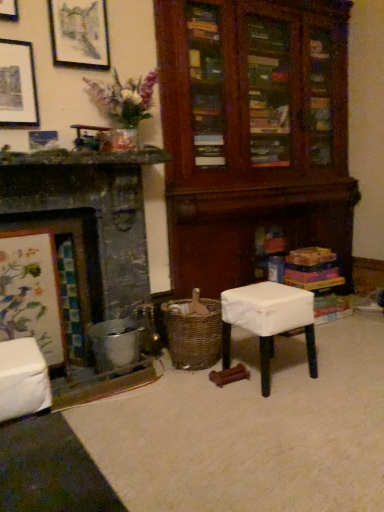
How much space does matte black picture frame at upper left, which appears as the 3th picture frame when ordered from the bottom, occupy vertically?

17.07 inches.

Where is `metallic silver fireplace at left`? Image resolution: width=384 pixels, height=512 pixels. metallic silver fireplace at left is located at coordinates (86, 254).

Describe the element at coordinates (86, 254) in the screenshot. The image size is (384, 512). I see `metallic silver fireplace at left` at that location.

Measure the distance between matte black picture frame at upper left, the 2th picture frame when ordered from top to bottom, and camera.

matte black picture frame at upper left, the 2th picture frame when ordered from top to bottom, and camera are 7.12 feet apart from each other.

Locate an element on the screen. white fabric-covered stool at center is located at coordinates (268, 321).

Is matte black picture frame at upper left, marked as the 2th picture frame in a bottom-to-top arrangement, not within metallic silver picture frame at upper left, which is the third picture frame in top-to-bottom order?

Absolutely, matte black picture frame at upper left, marked as the 2th picture frame in a bottom-to-top arrangement, is external to metallic silver picture frame at upper left, which is the third picture frame in top-to-bottom order.

Is matte black picture frame at upper left, the 2th picture frame when ordered from top to bottom, directly adjacent to metallic silver picture frame at upper left, which is the first picture frame from bottom to top?

No, matte black picture frame at upper left, the 2th picture frame when ordered from top to bottom, is not making contact with metallic silver picture frame at upper left, which is the first picture frame from bottom to top.

Which is more to the left, matte black picture frame at upper left, the 2th picture frame when ordered from top to bottom, or metallic silver picture frame at upper left, which is the first picture frame from bottom to top?

From the viewer's perspective, matte black picture frame at upper left, the 2th picture frame when ordered from top to bottom, appears more on the left side.

Does matte black picture frame at upper left, marked as the 2th picture frame in a bottom-to-top arrangement, have a greater width compared to metallic silver picture frame at upper left, which is the third picture frame in top-to-bottom order?

In fact, matte black picture frame at upper left, marked as the 2th picture frame in a bottom-to-top arrangement, might be narrower than metallic silver picture frame at upper left, which is the third picture frame in top-to-bottom order.

Looking at their sizes, would you say matte black picture frame at upper left, the 2th picture frame when ordered from top to bottom, is wider or thinner than white fabric-covered stool at center?

Clearly, matte black picture frame at upper left, the 2th picture frame when ordered from top to bottom, has less width compared to white fabric-covered stool at center.

Between matte black picture frame at upper left, the 2th picture frame when ordered from top to bottom, and white fabric-covered stool at center, which one has more height?

white fabric-covered stool at center is taller.

In the scene shown: Is white fabric-covered stool at center at the back of matte black picture frame at upper left, the 2th picture frame when ordered from top to bottom?

matte black picture frame at upper left, the 2th picture frame when ordered from top to bottom, does not have its back to white fabric-covered stool at center.

Is matte black picture frame at upper left, marked as the 2th picture frame in a bottom-to-top arrangement, to the right of white fabric-covered stool at center from the viewer's perspective?

Incorrect, matte black picture frame at upper left, marked as the 2th picture frame in a bottom-to-top arrangement, is not on the right side of white fabric-covered stool at center.

Relative to matte black picture frame at upper left, marked as the 2th picture frame in a bottom-to-top arrangement, is metallic silver picture frame at upper left, which is the third picture frame in top-to-bottom order, in front or behind?

Clearly, metallic silver picture frame at upper left, which is the third picture frame in top-to-bottom order, is behind matte black picture frame at upper left, marked as the 2th picture frame in a bottom-to-top arrangement.

How many degrees apart are the facing directions of metallic silver picture frame at upper left, which is the first picture frame from bottom to top, and matte black picture frame at upper left, the 2th picture frame when ordered from top to bottom?

The angle between the facing direction of metallic silver picture frame at upper left, which is the first picture frame from bottom to top, and the facing direction of matte black picture frame at upper left, the 2th picture frame when ordered from top to bottom, is 0.605 degrees.

Is metallic silver picture frame at upper left, which is the third picture frame in top-to-bottom order, placed right next to matte black picture frame at upper left, marked as the 2th picture frame in a bottom-to-top arrangement?

metallic silver picture frame at upper left, which is the third picture frame in top-to-bottom order, is not next to matte black picture frame at upper left, marked as the 2th picture frame in a bottom-to-top arrangement, and they're not touching.

Considering the positions of objects metallic silver fireplace at left and white fabric-covered stool at center in the image provided, who is more to the right, metallic silver fireplace at left or white fabric-covered stool at center?

Positioned to the right is white fabric-covered stool at center.

Locate an element on the screen. fireplace above the white fabric-covered stool at center (from the image's perspective) is located at coordinates (86, 254).

Consider the image. Considering the relative sizes of metallic silver fireplace at left and white fabric-covered stool at center in the image provided, is metallic silver fireplace at left wider than white fabric-covered stool at center?

Yes, metallic silver fireplace at left is wider than white fabric-covered stool at center.

What's the angular difference between metallic silver fireplace at left and white fabric-covered stool at center's facing directions?

0.0513 degrees.

Consider the image. Is metallic silver picture frame at upper left, which is the third picture frame in top-to-bottom order, surrounding matte black picture frame at upper left, the 1th picture frame in the top-to-bottom sequence?

Definitely not — matte black picture frame at upper left, the 1th picture frame in the top-to-bottom sequence, is not inside metallic silver picture frame at upper left, which is the third picture frame in top-to-bottom order.

The height and width of the screenshot is (512, 384). I want to click on the 2nd picture frame above the metallic silver picture frame at upper left, which is the third picture frame in top-to-bottom order (from the image's perspective), so click(x=79, y=33).

Considering the relative sizes of metallic silver picture frame at upper left, which is the third picture frame in top-to-bottom order, and matte black picture frame at upper left, the 1th picture frame in the top-to-bottom sequence, in the image provided, is metallic silver picture frame at upper left, which is the third picture frame in top-to-bottom order, bigger than matte black picture frame at upper left, the 1th picture frame in the top-to-bottom sequence,?

Incorrect, metallic silver picture frame at upper left, which is the third picture frame in top-to-bottom order, is not larger than matte black picture frame at upper left, the 1th picture frame in the top-to-bottom sequence.

From the image's perspective, which object appears higher, metallic silver picture frame at upper left, which is the third picture frame in top-to-bottom order, or matte black picture frame at upper left, the 1th picture frame in the top-to-bottom sequence?

matte black picture frame at upper left, the 1th picture frame in the top-to-bottom sequence.

Is the surface of white fabric-covered stool at center in direct contact with metallic silver picture frame at upper left, which is the first picture frame from bottom to top?

There is a gap between white fabric-covered stool at center and metallic silver picture frame at upper left, which is the first picture frame from bottom to top.

From a real-world perspective, is white fabric-covered stool at center physically above metallic silver picture frame at upper left, which is the third picture frame in top-to-bottom order?

Actually, white fabric-covered stool at center is physically below metallic silver picture frame at upper left, which is the third picture frame in top-to-bottom order, in the real world.

Considering the positions of objects white fabric-covered stool at center and metallic silver picture frame at upper left, which is the first picture frame from bottom to top, in the image provided, who is more to the left, white fabric-covered stool at center or metallic silver picture frame at upper left, which is the first picture frame from bottom to top,?

metallic silver picture frame at upper left, which is the first picture frame from bottom to top, is more to the left.

Is point (224, 338) closer or farther from the camera than point (57, 140)?

Point (224, 338) is farther from the camera than point (57, 140).

From the picture: Which point is more forward, (105, 14) or (268, 374)?

Positioned in front is point (268, 374).

Who is shorter, matte black picture frame at upper left, which appears as the 3th picture frame when ordered from the bottom, or white fabric-covered stool at center?

matte black picture frame at upper left, which appears as the 3th picture frame when ordered from the bottom.

Where is `the 1st picture frame to the left when counting from the white fabric-covered stool at center`? The image size is (384, 512). the 1st picture frame to the left when counting from the white fabric-covered stool at center is located at coordinates (79, 33).

Where is `picture frame in front of the metallic silver picture frame at upper left, which is the first picture frame from bottom to top`? The width and height of the screenshot is (384, 512). picture frame in front of the metallic silver picture frame at upper left, which is the first picture frame from bottom to top is located at coordinates (18, 85).

I want to click on picture frame that is the 1st one when counting backward from the white fabric-covered stool at center, so click(x=18, y=85).

In the scene shown: Looking at the image, which one is located closer to woven brown basket at lower center, white fabric-covered stool at center or matte black picture frame at upper left, the 2th picture frame when ordered from top to bottom?

white fabric-covered stool at center is closer to woven brown basket at lower center.

Looking at this image, when comparing their distances from metallic silver fireplace at left, does metallic silver picture frame at upper left, which is the third picture frame in top-to-bottom order, or woven brown basket at lower center seem further?

metallic silver picture frame at upper left, which is the third picture frame in top-to-bottom order.

From the image, which object appears to be nearer to white fabric-covered stool at center, metallic silver picture frame at upper left, which is the third picture frame in top-to-bottom order, or woven brown basket at lower center?

woven brown basket at lower center lies closer to white fabric-covered stool at center than the other object.

Looking at this image, considering their positions, is matte black picture frame at upper left, the 2th picture frame when ordered from top to bottom, positioned closer to woven brown basket at lower center than white fabric-covered stool at center?

white fabric-covered stool at center is positioned closer to the anchor woven brown basket at lower center.

From the image, which object appears to be nearer to matte black picture frame at upper left, the 2th picture frame when ordered from top to bottom, metallic silver picture frame at upper left, which is the third picture frame in top-to-bottom order, or white fabric-covered stool at center?

metallic silver picture frame at upper left, which is the third picture frame in top-to-bottom order.

From the image, which object appears to be nearer to white fabric-covered stool at center, matte black picture frame at upper left, the 1th picture frame in the top-to-bottom sequence, or woven brown basket at lower center?

woven brown basket at lower center is positioned closer to the anchor white fabric-covered stool at center.

Estimate the real-world distances between objects in this image. Which object is closer to woven brown basket at lower center, metallic silver picture frame at upper left, which is the third picture frame in top-to-bottom order, or metallic silver fireplace at left?

metallic silver fireplace at left is positioned closer to the anchor woven brown basket at lower center.

Looking at the image, which one is located closer to metallic silver picture frame at upper left, which is the first picture frame from bottom to top, matte black picture frame at upper left, marked as the 2th picture frame in a bottom-to-top arrangement, or matte black picture frame at upper left, the 1th picture frame in the top-to-bottom sequence?

matte black picture frame at upper left, marked as the 2th picture frame in a bottom-to-top arrangement.

I want to click on fireplace between metallic silver picture frame at upper left, which is the first picture frame from bottom to top, and woven brown basket at lower center, in the vertical direction, so click(x=86, y=254).

The width and height of the screenshot is (384, 512). I want to click on stool that lies between matte black picture frame at upper left, the 2th picture frame when ordered from top to bottom, and woven brown basket at lower center from top to bottom, so click(x=268, y=321).

In order to click on fireplace between matte black picture frame at upper left, the 2th picture frame when ordered from top to bottom, and white fabric-covered stool at center from left to right in this screenshot , I will do `click(86, 254)`.

Find the location of a particular element. The height and width of the screenshot is (512, 384). picture frame between matte black picture frame at upper left, which appears as the 3th picture frame when ordered from the bottom, and metallic silver picture frame at upper left, which is the first picture frame from bottom to top, in the vertical direction is located at coordinates (18, 85).